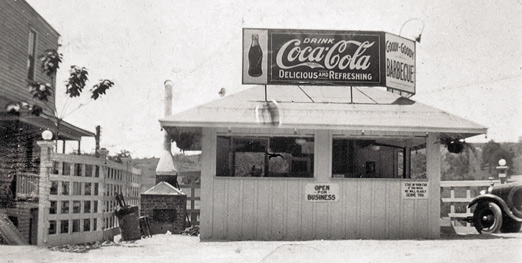
Locate an element on the screen. This screenshot has width=522, height=263. small circular lamps is located at coordinates (501, 160), (45, 137).